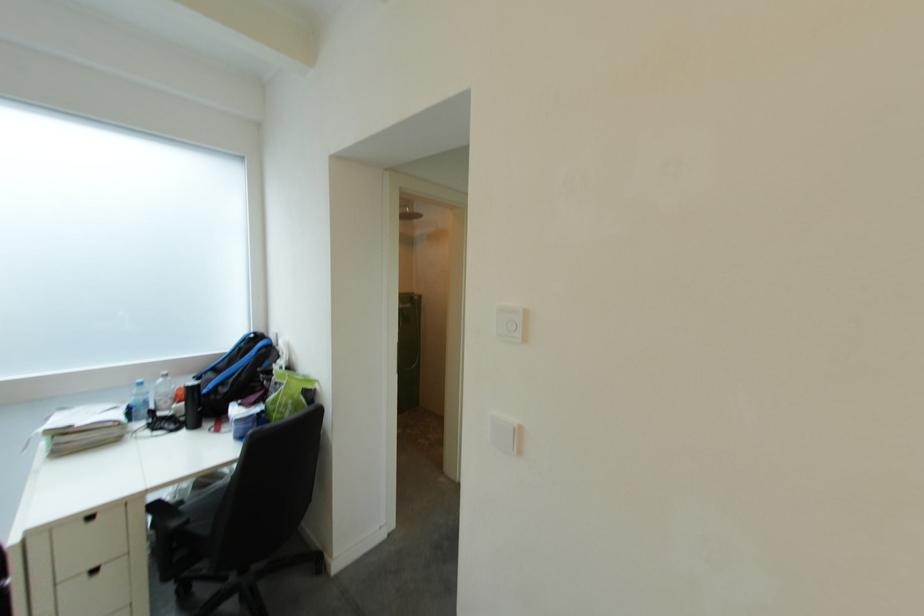
You are a GUI agent. You are given a task and a screenshot of the screen. Output one action in this format:
    pyautogui.click(x=<x>, y=<y>)
    Task: Click on the chair sitting surface
    This screenshot has width=924, height=616.
    Given the screenshot: What is the action you would take?
    pyautogui.click(x=207, y=508)